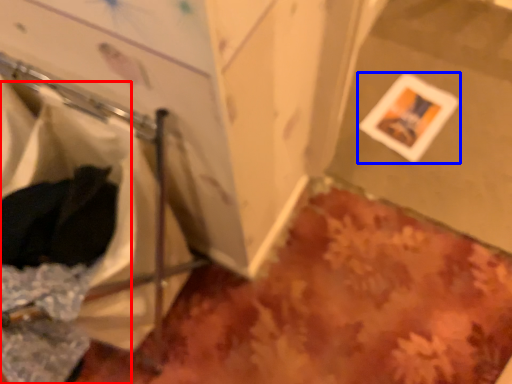
Question: Which object is further to the camera taking this photo, laundry (highlighted by a red box) or picture frame (highlighted by a blue box)?

Choices:
 (A) laundry
 (B) picture frame

Answer: (B)